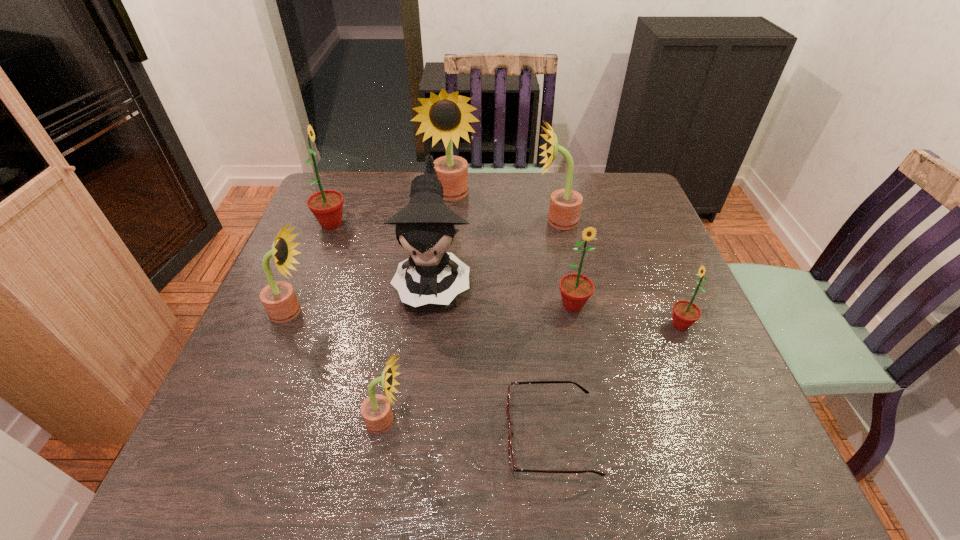
The height and width of the screenshot is (540, 960). I want to click on vacant space that is in between the second green sunflower from right to left and the smallest yellow sunflower, so pos(479,363).

At what (x,y) coordinates should I click in order to perform the action: click on blank region between the tallest object and the leftmost yellow sunflower. Please return your answer as a coordinate pair (x, y). Image resolution: width=960 pixels, height=540 pixels. Looking at the image, I should click on (372, 254).

The width and height of the screenshot is (960, 540). In order to click on vacant space in between the second smallest green sunflower and the tallest object in this screenshot , I will do `click(512, 251)`.

This screenshot has height=540, width=960. Identify the location of free space between the leftmost green sunflower and the rightmost sunflower. (506, 274).

Find the location of a particular element. The width and height of the screenshot is (960, 540). free space that is in between the second nearest yellow sunflower and the doll is located at coordinates (363, 295).

Find the location of a particular element. vacant area between the rightmost green sunflower and the leftmost yellow sunflower is located at coordinates (486, 318).

Identify the location of vacant space in between the leftmost green sunflower and the rightmost sunflower. The height and width of the screenshot is (540, 960). (506, 274).

This screenshot has height=540, width=960. In order to click on free spot between the biggest green sunflower and the nearest yellow sunflower in this screenshot , I will do `click(359, 322)`.

Find the location of a particular element. the sixth closest object to the second smallest green sunflower is located at coordinates (446, 116).

Image resolution: width=960 pixels, height=540 pixels. In order to click on the eighth closest object to the leftmost green sunflower in this screenshot , I will do click(685, 313).